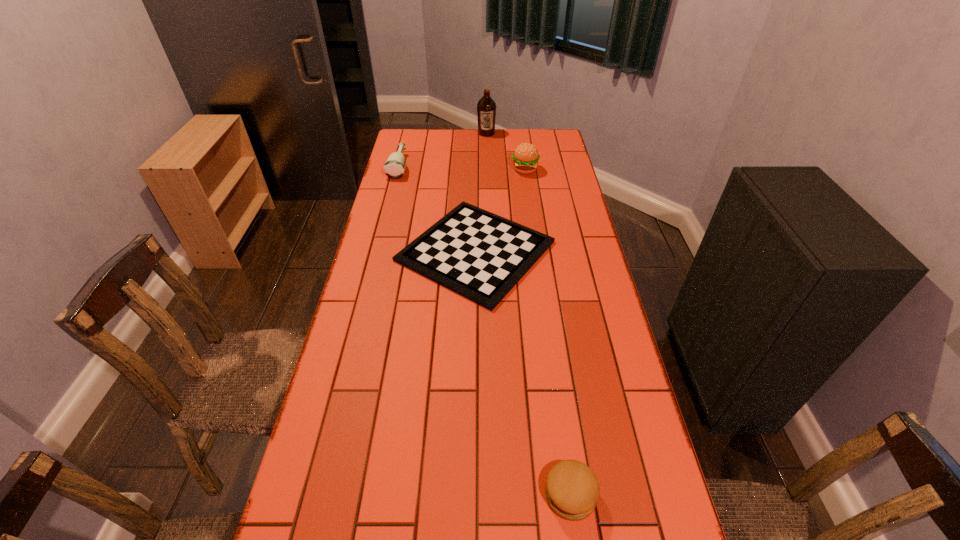
You are a GUI agent. You are given a task and a screenshot of the screen. Output one action in this format:
    pyautogui.click(x=<x>, y=<y>)
    Task: Click on the vacant space at the far edge of the desktop
    
    Given the screenshot: What is the action you would take?
    pyautogui.click(x=440, y=134)

The height and width of the screenshot is (540, 960). In the image, there is a desktop. Find the location of `vacant space at the left edge`. vacant space at the left edge is located at coordinates (375, 234).

At what (x,y) coordinates should I click in order to perform the action: click on vacant space at the right edge of the desktop. Please return your answer as a coordinate pair (x, y). Looking at the image, I should click on (583, 241).

At what (x,y) coordinates should I click in order to perform the action: click on free area in between the bottle and the farthest object. Please return your answer as a coordinate pair (x, y). The width and height of the screenshot is (960, 540). Looking at the image, I should click on (443, 150).

Identify the location of vacant area that lies between the nearest object and the bottle. The height and width of the screenshot is (540, 960). (485, 330).

The image size is (960, 540). In order to click on unoccupied position between the farthest object and the checkerboard in this screenshot , I will do `click(481, 192)`.

Locate an element on the screen. The width and height of the screenshot is (960, 540). vacant area between the checkerboard and the farther hamburger is located at coordinates (500, 210).

Where is `free space that is in between the tallest object and the nearer hamburger`? This screenshot has height=540, width=960. free space that is in between the tallest object and the nearer hamburger is located at coordinates coord(528,314).

Where is `vacant area between the nearest object and the checkerboard`? Image resolution: width=960 pixels, height=540 pixels. vacant area between the nearest object and the checkerboard is located at coordinates (523, 373).

You are a GUI agent. You are given a task and a screenshot of the screen. Output one action in this format:
    pyautogui.click(x=<x>, y=<y>)
    Task: Click on the vacant area that lies between the shorter hamburger and the fourth shortest object
    The height and width of the screenshot is (540, 960).
    Given the screenshot: What is the action you would take?
    pyautogui.click(x=547, y=332)